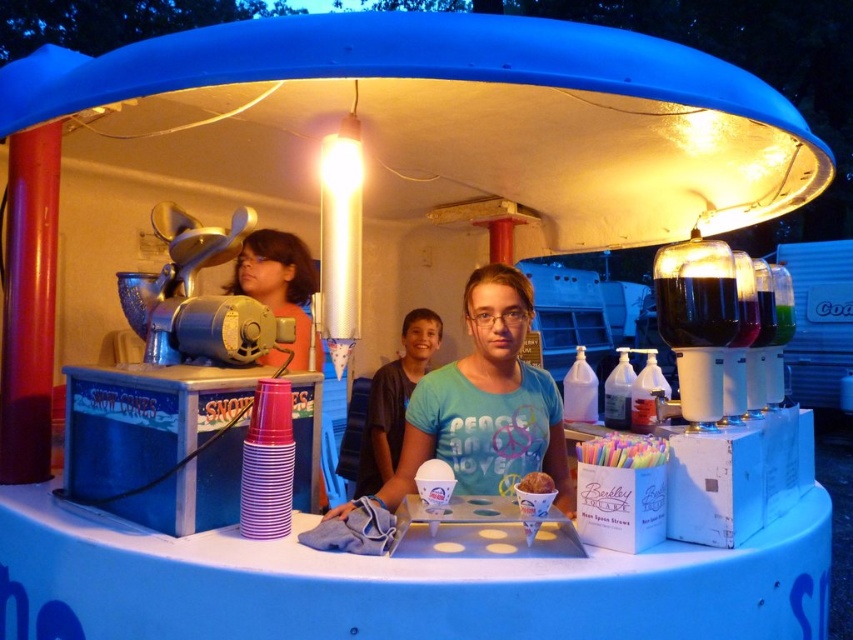
What is the exact position of the blue cotton shirt at center in the image?

The blue cotton shirt at center is located at point coordinates of (x=486, y=403).

You are a customer at the snow cone stand and want to grab the golden brown pastry at center. However, the blue cotton shirt at center is in your way. Can you reach the pastry without moving the shirt?

The golden brown pastry at center is behind blue cotton shirt at center, so you cannot reach it without moving the shirt.